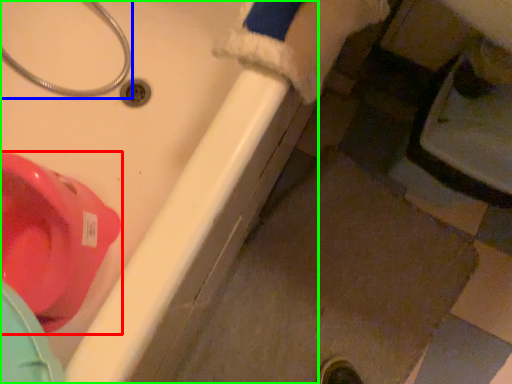
Question: Which is nearer to the toilet (highlighted by a red box)? plumbing fixture (highlighted by a blue box) or bath (highlighted by a green box).

Choices:
 (A) plumbing fixture
 (B) bath

Answer: (B)